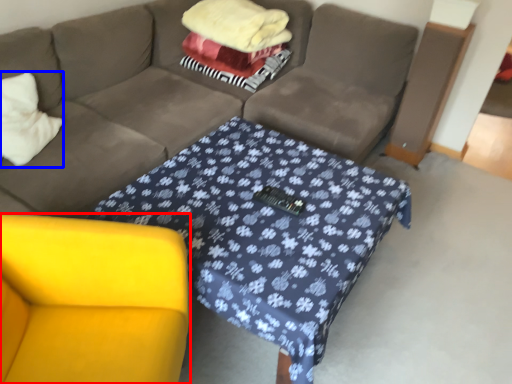
Question: Which object appears farthest to the camera in this image, armchair (highlighted by a red box) or throw pillow (highlighted by a blue box)?

Choices:
 (A) armchair
 (B) throw pillow

Answer: (B)